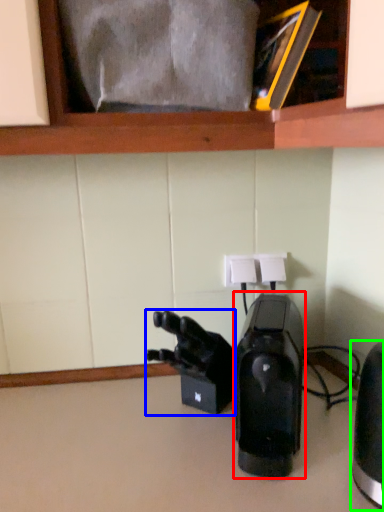
Question: Based on their relative distances, which object is farther from home appliance (highlighted by a red box)? Choose from video camera (highlighted by a blue box) and home appliance (highlighted by a green box).

Choices:
 (A) video camera
 (B) home appliance

Answer: (B)